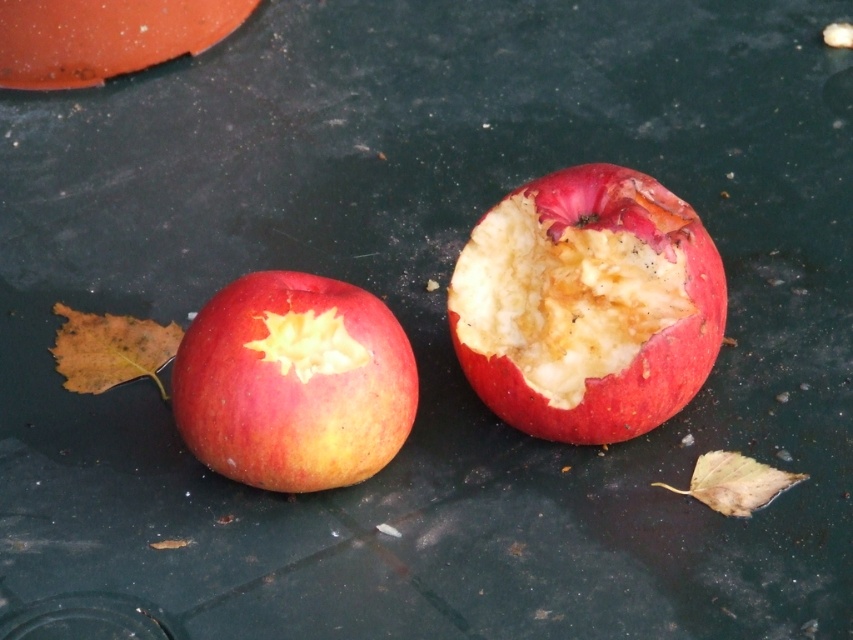
You are trying to determine which apple is taller between the red matte apple at center and the shiny red apple at center. Based on the scene, which one is taller?

The red matte apple at center is taller than the shiny red apple at center.

You have two apples on a table. The red matte apple at center and the shiny red apple at center. Which one is wider?

The red matte apple at center is wider than the shiny red apple at center.